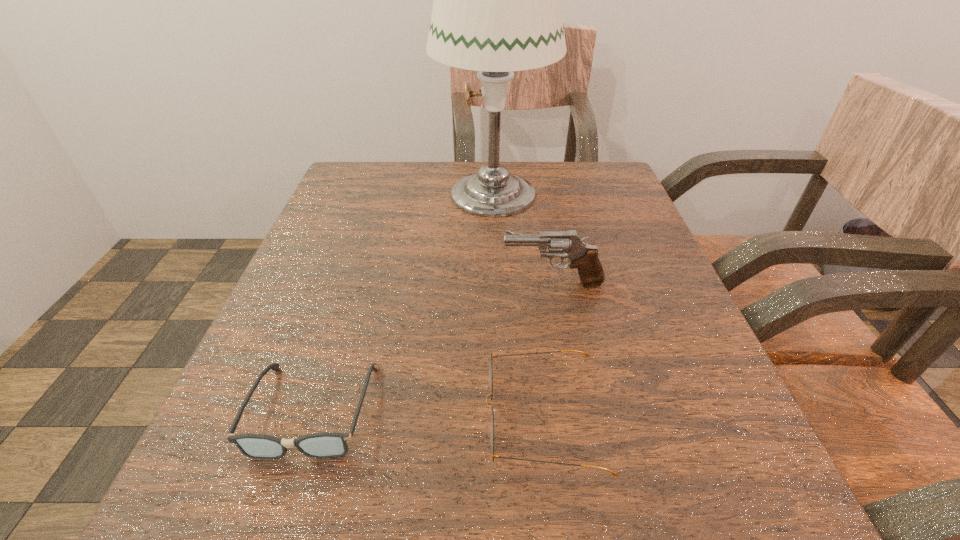
The height and width of the screenshot is (540, 960). I want to click on vacant region that satisfies the following two spatial constraints: 1. on the lampshade of the farthest object; 2. on the face of the leftmost object, so click(x=502, y=410).

Image resolution: width=960 pixels, height=540 pixels. I want to click on free point that satisfies the following two spatial constraints: 1. on the lampshade of the lampshade; 2. on the face of the leftmost object, so click(502, 410).

At what (x,y) coordinates should I click in order to perform the action: click on vacant point that satisfies the following two spatial constraints: 1. on the lampshade of the tallest object; 2. on the face of the shorter spectacles. Please return your answer as a coordinate pair (x, y). The height and width of the screenshot is (540, 960). Looking at the image, I should click on (502, 410).